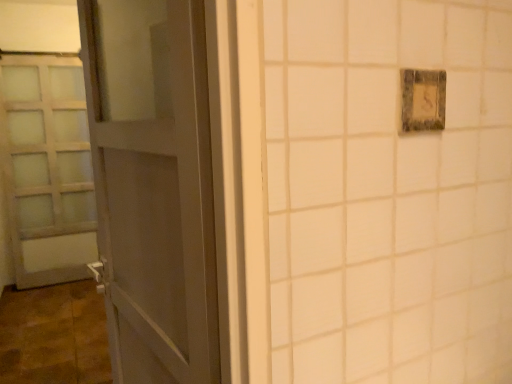
Question: Should I look upward or downward to see satin white door at left, the second door in the right-to-left sequence?

Choices:
 (A) up
 (B) down

Answer: (A)

Question: From the image's perspective, is matte gray door at left, which is the 1th door in right-to-left order, under satin white door at left, the 1th door viewed from the left?

Choices:
 (A) yes
 (B) no

Answer: (A)

Question: Is matte gray door at left, the 2th door viewed from the back, outside satin white door at left, which is counted as the second door, starting from the front?

Choices:
 (A) yes
 (B) no

Answer: (A)

Question: Is matte gray door at left, which is the 1th door in right-to-left order, to the right of satin white door at left, which is counted as the second door, starting from the front, from the viewer's perspective?

Choices:
 (A) yes
 (B) no

Answer: (A)

Question: Is matte gray door at left, the first door positioned from the front, to the left of satin white door at left, which is counted as the second door, starting from the front, from the viewer's perspective?

Choices:
 (A) yes
 (B) no

Answer: (B)

Question: From the image's perspective, is matte gray door at left, the 2th door viewed from the left, over satin white door at left, which is counted as the second door, starting from the front?

Choices:
 (A) yes
 (B) no

Answer: (B)

Question: Is matte gray door at left, the 2th door viewed from the back, with satin white door at left, the 1th door viewed from the left?

Choices:
 (A) yes
 (B) no

Answer: (B)

Question: From the image's perspective, is rustic wood light switch at upper right under matte gray door at left, the first door positioned from the front?

Choices:
 (A) yes
 (B) no

Answer: (B)

Question: Could you tell me if rustic wood light switch at upper right is facing matte gray door at left, which is the 1th door in right-to-left order?

Choices:
 (A) yes
 (B) no

Answer: (B)

Question: Is the position of rustic wood light switch at upper right less distant than that of matte gray door at left, the 2th door viewed from the back?

Choices:
 (A) yes
 (B) no

Answer: (B)

Question: Is rustic wood light switch at upper right facing away from matte gray door at left, the 2th door viewed from the left?

Choices:
 (A) yes
 (B) no

Answer: (B)

Question: Considering the relative positions of rustic wood light switch at upper right and matte gray door at left, the 2th door viewed from the back, in the image provided, is rustic wood light switch at upper right to the right of matte gray door at left, the 2th door viewed from the back, from the viewer's perspective?

Choices:
 (A) yes
 (B) no

Answer: (A)

Question: Considering the relative sizes of rustic wood light switch at upper right and matte gray door at left, the 2th door viewed from the back, in the image provided, is rustic wood light switch at upper right bigger than matte gray door at left, the 2th door viewed from the back,?

Choices:
 (A) no
 (B) yes

Answer: (A)

Question: Considering the relative positions of rustic wood light switch at upper right and satin white door at left, the second door in the right-to-left sequence, in the image provided, is rustic wood light switch at upper right to the left of satin white door at left, the second door in the right-to-left sequence, from the viewer's perspective?

Choices:
 (A) yes
 (B) no

Answer: (B)